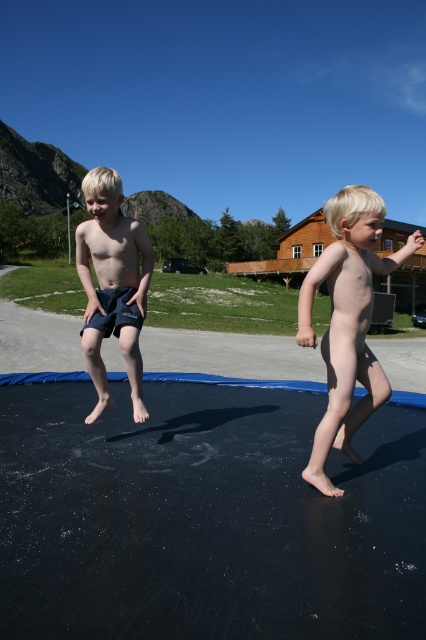
Is nude skin at center taller than dark blue shorts at left?

Yes, nude skin at center is taller than dark blue shorts at left.

Is nude skin at center bigger than dark blue shorts at left?

Yes, nude skin at center is bigger than dark blue shorts at left.

Who is more distant from viewer, [322,259] or [101,385]?

Point [101,385]

Find the location of `nude skin at center`. nude skin at center is located at coordinates (348, 321).